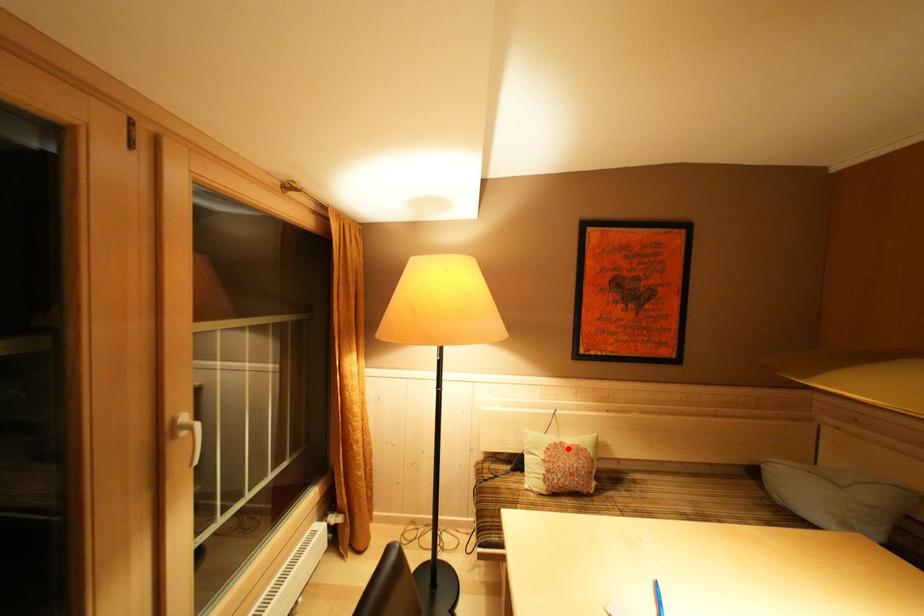
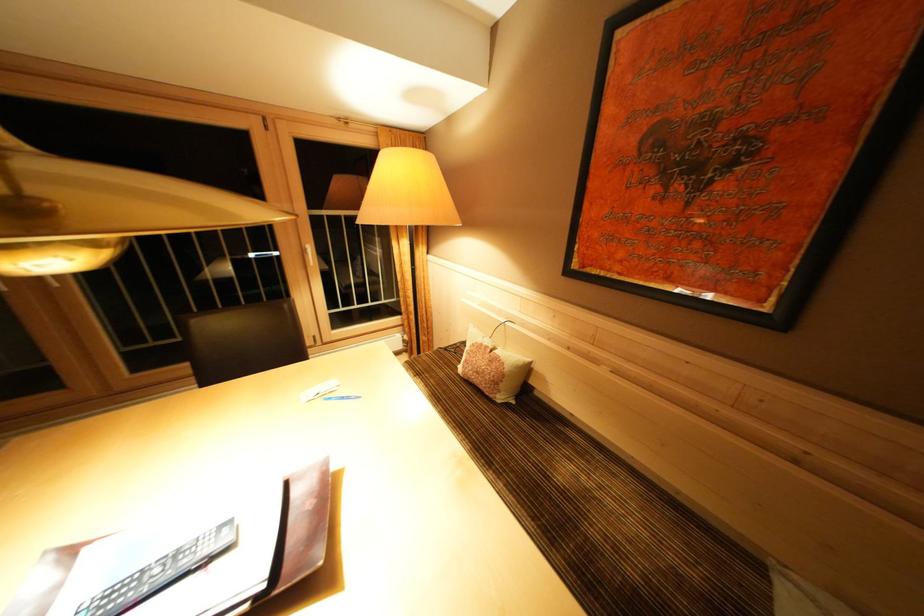
Question: I am providing you with two images of the same scene from different viewpoints. In image1, a red point is highlighted. Considering the same 3D point in image2, which of the following is correct?

Choices:
 (A) It is closer
 (B) It is farther

Answer: (A)